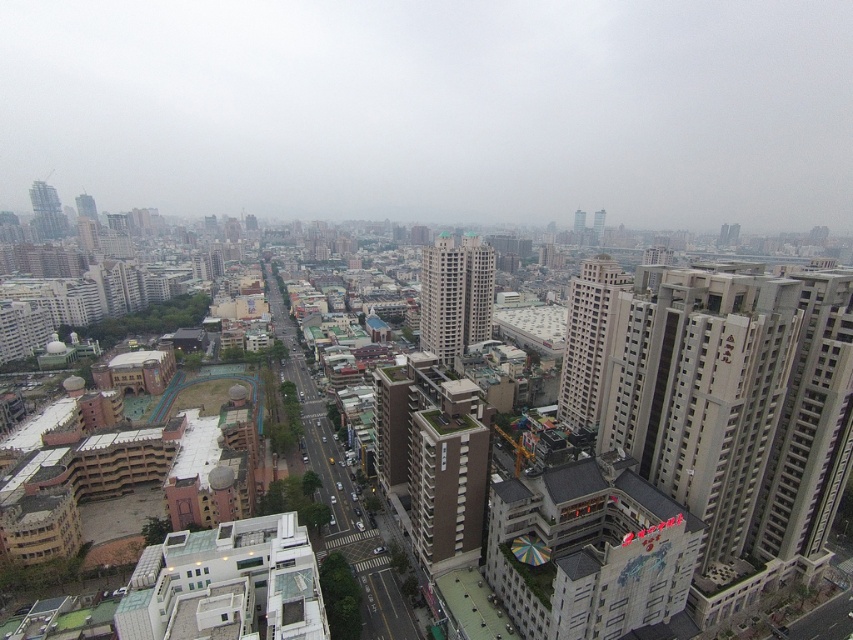
Question: Which point is closer to the camera?

Choices:
 (A) (578, 413)
 (B) (38, 192)

Answer: (A)

Question: Does beige concrete building at center have a smaller size compared to gray concrete skyscraper at upper right?

Choices:
 (A) no
 (B) yes

Answer: (A)

Question: Among these points, which one is nearest to the camera?

Choices:
 (A) (599, 232)
 (B) (41, 188)
 (C) (578, 237)

Answer: (B)

Question: Among these objects, which one is nearest to the camera?

Choices:
 (A) metallic glass skyscraper at left
 (B) gray concrete skyscraper at upper right
 (C) transparent glass sky at upper center

Answer: (A)

Question: Is beige concrete building at center-right positioned before gray concrete skyscraper at upper right?

Choices:
 (A) yes
 (B) no

Answer: (A)

Question: Observing the image, what is the correct spatial positioning of metallic glass skyscraper at left in reference to smooth glass skyscraper at center-right?

Choices:
 (A) right
 (B) left

Answer: (B)